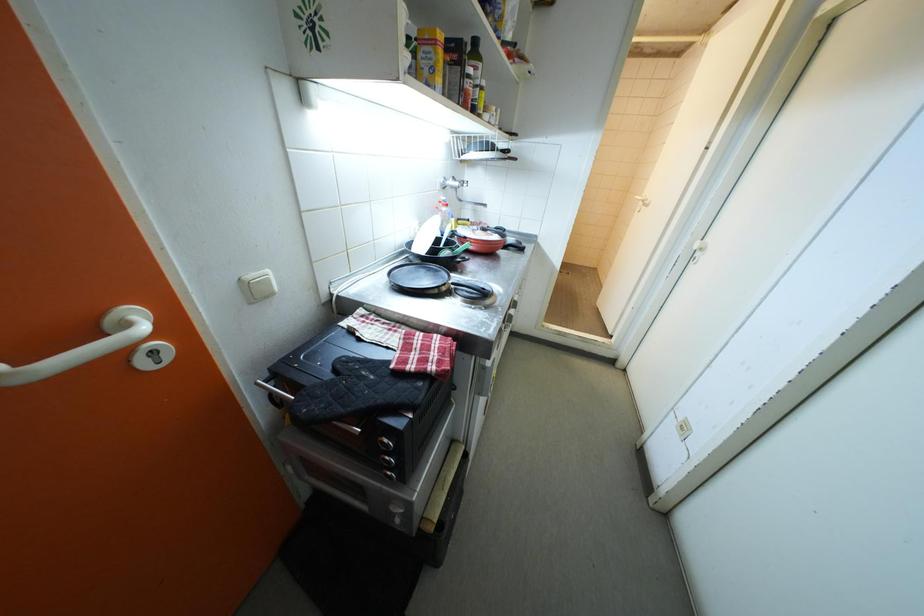
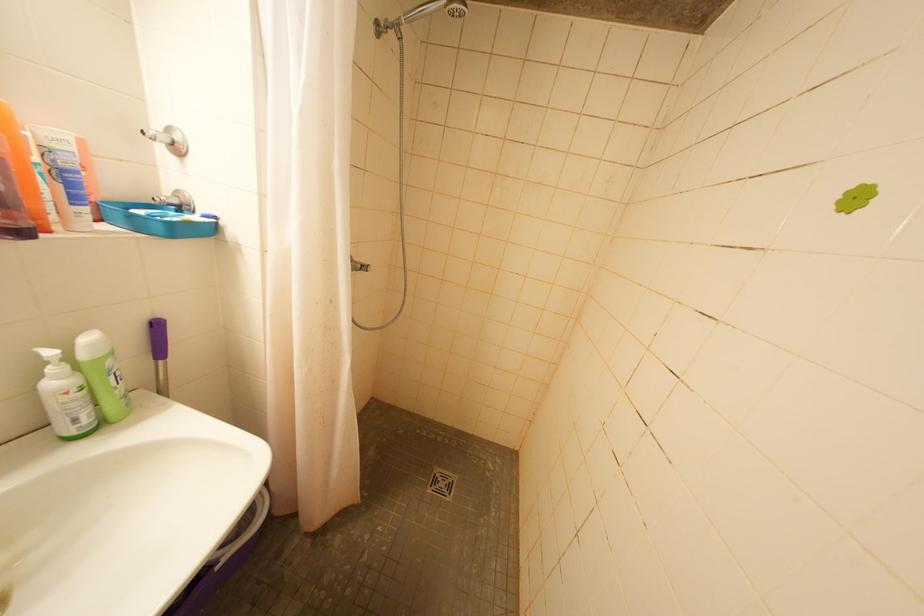
What movement of the cameraman would produce the second image?

The cameraman walked toward right, forward.